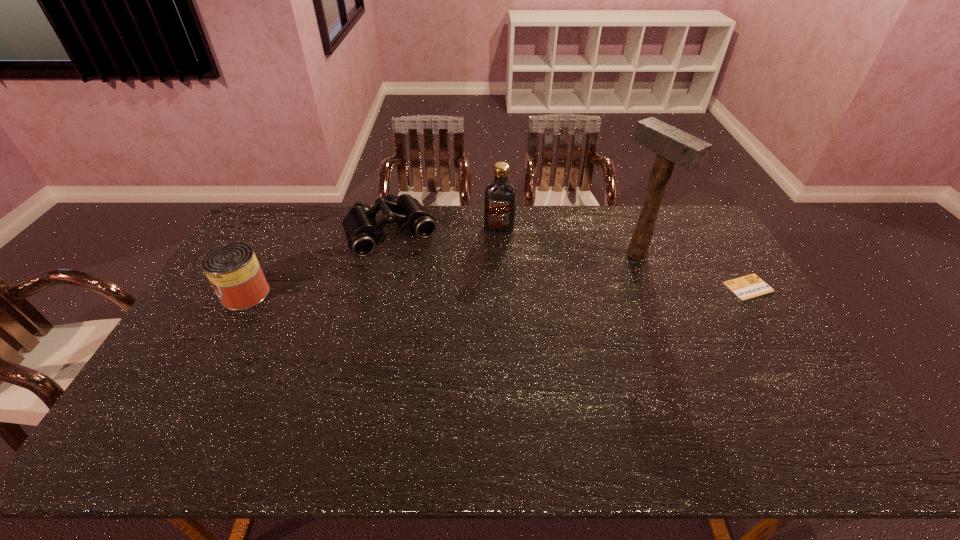
The width and height of the screenshot is (960, 540). I want to click on free space between the second shortest object and the mallet, so click(514, 243).

Locate which object ranks second in proximity to the tallest object. Please provide its 2D coordinates. Your answer should be formatted as a tuple, i.e. [(x, y)], where the tuple contains the x and y coordinates of a point satisfying the conditions above.

[(499, 195)]

This screenshot has height=540, width=960. In order to click on object that is the third closest one to the rightmost object in this screenshot , I will do `click(363, 232)`.

The image size is (960, 540). What are the coordinates of `blank area in the image that satisfies the following two spatial constraints: 1. on the front side of the mallet; 2. on the right side of the second shortest object` in the screenshot? It's located at (387, 254).

Find the location of a particular element. The width and height of the screenshot is (960, 540). vacant point that satisfies the following two spatial constraints: 1. on the back side of the third shortest object; 2. on the left side of the binoculars is located at coordinates (279, 232).

This screenshot has width=960, height=540. I want to click on vacant region that satisfies the following two spatial constraints: 1. on the front side of the second shortest object; 2. on the right side of the tallest object, so click(x=387, y=254).